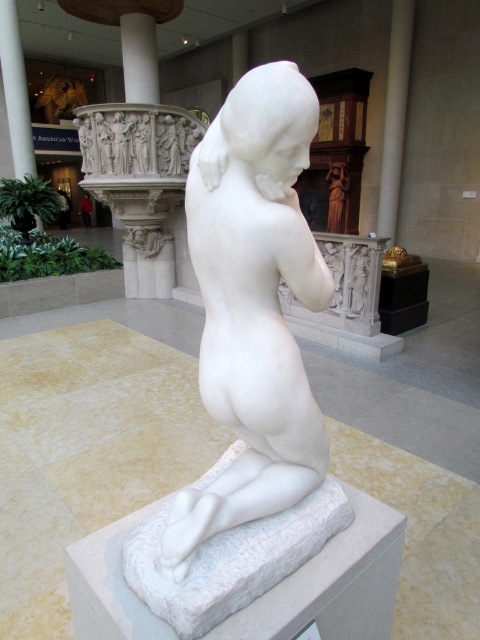
Question: Is white marble statue at center bigger than white marble pillar at left?

Choices:
 (A) yes
 (B) no

Answer: (B)

Question: Considering the real-world distances, which object is closest to the white marble pillar at center?

Choices:
 (A) white marble statue at center
 (B) white marble pillar at left

Answer: (B)

Question: Can you confirm if white marble pillar at center is smaller than white marble pillar at left?

Choices:
 (A) yes
 (B) no

Answer: (A)

Question: Is white marble pillar at center wider than white marble pillar at left?

Choices:
 (A) no
 (B) yes

Answer: (A)

Question: Estimate the real-world distances between objects in this image. Which object is closer to the white marble statue at center?

Choices:
 (A) white marble pillar at left
 (B) white marble pillar at center

Answer: (B)

Question: Among these objects, which one is nearest to the camera?

Choices:
 (A) white marble pillar at center
 (B) white marble statue at center

Answer: (B)